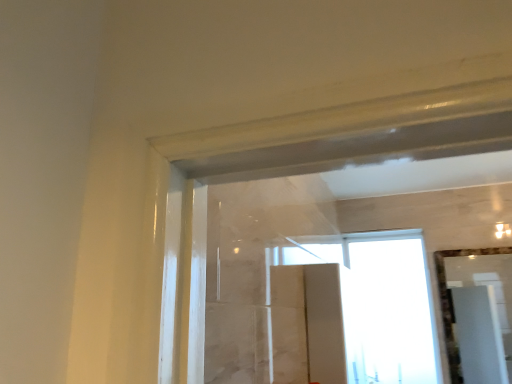
Question: From a real-world perspective, is transparent glass window at upper center physically located above or below clear glass mirror at upper right?

Choices:
 (A) below
 (B) above

Answer: (B)

Question: Which is correct: transparent glass window at upper center is inside clear glass mirror at upper right, or outside of it?

Choices:
 (A) outside
 (B) inside

Answer: (A)

Question: From the image's perspective, relative to clear glass mirror at upper right, is transparent glass window at upper center above or below?

Choices:
 (A) above
 (B) below

Answer: (B)

Question: Looking at their shapes, would you say clear glass mirror at upper right is wider or thinner than transparent glass window at upper center?

Choices:
 (A) wide
 (B) thin

Answer: (B)

Question: From a real-world perspective, relative to transparent glass window at upper center, is clear glass mirror at upper right vertically above or below?

Choices:
 (A) above
 (B) below

Answer: (B)

Question: Based on their positions, is clear glass mirror at upper right located to the left or right of transparent glass window at upper center?

Choices:
 (A) left
 (B) right

Answer: (B)

Question: In terms of height, does clear glass mirror at upper right look taller or shorter compared to transparent glass window at upper center?

Choices:
 (A) short
 (B) tall

Answer: (A)